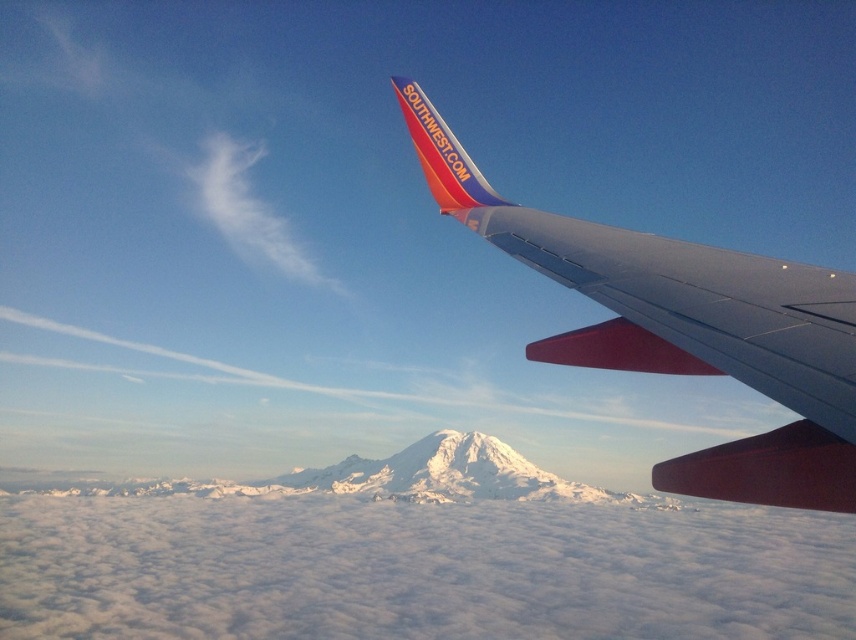
In the scene shown: You are a passenger sitting at the window seat and looking out. You see the smooth metallic wing at upper right and the matte plastic airplane winglet at upper right. Which object is closer to you?

The smooth metallic wing at upper right is located below the matte plastic airplane winglet at upper right, so it is closer to you.

You are a pilot looking at the view from the cockpit window. You see two points in the distance, one at coordinates point (575, 284) and another at point (710, 310). Which point is closer to the airplane?

Point (710, 310) is closer to the airplane because it is in front of point (575, 284).